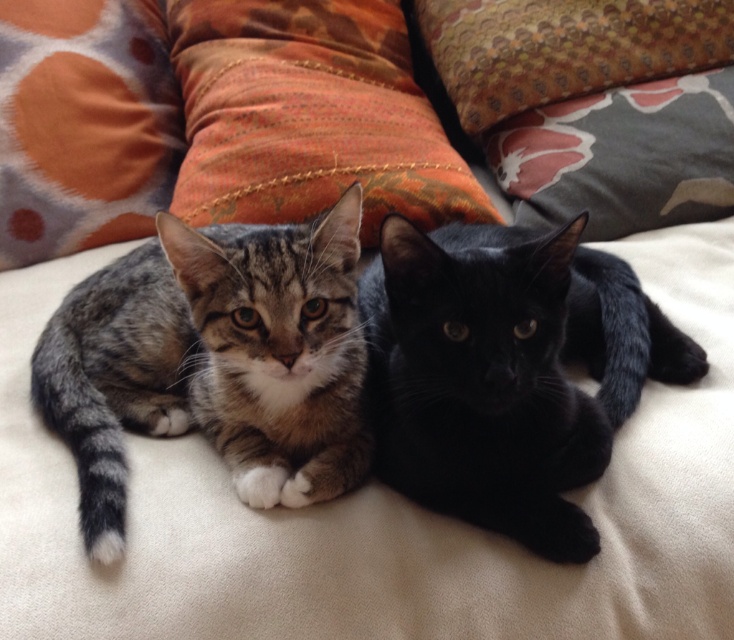
Between orange fabric pillow at upper left and gray fabric pillow at upper right, which one is positioned lower?

gray fabric pillow at upper right is below.

The width and height of the screenshot is (734, 640). Describe the element at coordinates (83, 124) in the screenshot. I see `orange fabric pillow at upper left` at that location.

I want to click on orange fabric pillow at upper left, so click(x=83, y=124).

What do you see at coordinates (214, 362) in the screenshot? This screenshot has height=640, width=734. I see `tabby fur cat at left` at bounding box center [214, 362].

Which is more to the left, tabby fur cat at left or gray fabric pillow at upper right?

tabby fur cat at left

At what (x,y) coordinates should I click in order to perform the action: click on tabby fur cat at left. Please return your answer as a coordinate pair (x, y). Looking at the image, I should click on tap(214, 362).

Can you confirm if tabby fur cat at left is shorter than textured fabric pillow at upper center?

No, tabby fur cat at left is not shorter than textured fabric pillow at upper center.

Does tabby fur cat at left appear under textured fabric pillow at upper center?

Yes, tabby fur cat at left is below textured fabric pillow at upper center.

Is point (244, 358) farther from camera compared to point (450, 17)?

No, it is not.

Where is `tabby fur cat at left`? The width and height of the screenshot is (734, 640). tabby fur cat at left is located at coordinates (214, 362).